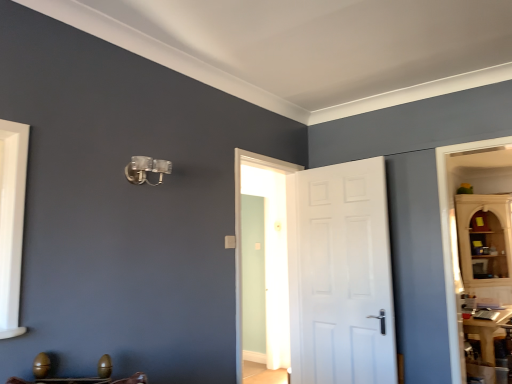
Question: Is white matte door at center outside wooden egg-shaped objects at lower left?

Choices:
 (A) no
 (B) yes

Answer: (B)

Question: Is white matte door at center closer to the viewer compared to wooden egg-shaped objects at lower left?

Choices:
 (A) yes
 (B) no

Answer: (B)

Question: From the image's perspective, is white matte door at center under wooden egg-shaped objects at lower left?

Choices:
 (A) yes
 (B) no

Answer: (B)

Question: Does white matte door at center lie behind wooden egg-shaped objects at lower left?

Choices:
 (A) yes
 (B) no

Answer: (A)

Question: Is white matte door at center turned away from wooden egg-shaped objects at lower left?

Choices:
 (A) yes
 (B) no

Answer: (B)

Question: Does white matte door at center appear on the right side of wooden egg-shaped objects at lower left?

Choices:
 (A) yes
 (B) no

Answer: (A)

Question: Could you tell me if wooden egg-shaped objects at lower left is turned towards white matte door at center?

Choices:
 (A) no
 (B) yes

Answer: (A)

Question: Considering the relative positions of wooden egg-shaped objects at lower left and white matte door at center in the image provided, is wooden egg-shaped objects at lower left to the left of white matte door at center from the viewer's perspective?

Choices:
 (A) yes
 (B) no

Answer: (A)

Question: Is wooden egg-shaped objects at lower left facing away from white matte door at center?

Choices:
 (A) yes
 (B) no

Answer: (A)

Question: Can you confirm if wooden egg-shaped objects at lower left is thinner than white matte door at center?

Choices:
 (A) yes
 (B) no

Answer: (B)

Question: From the image's perspective, is wooden egg-shaped objects at lower left beneath white matte door at center?

Choices:
 (A) yes
 (B) no

Answer: (A)

Question: Is wooden egg-shaped objects at lower left positioned behind white matte door at center?

Choices:
 (A) yes
 (B) no

Answer: (B)

Question: From a real-world perspective, is wooden egg-shaped objects at lower left positioned above or below white matte door at center?

Choices:
 (A) above
 (B) below

Answer: (B)